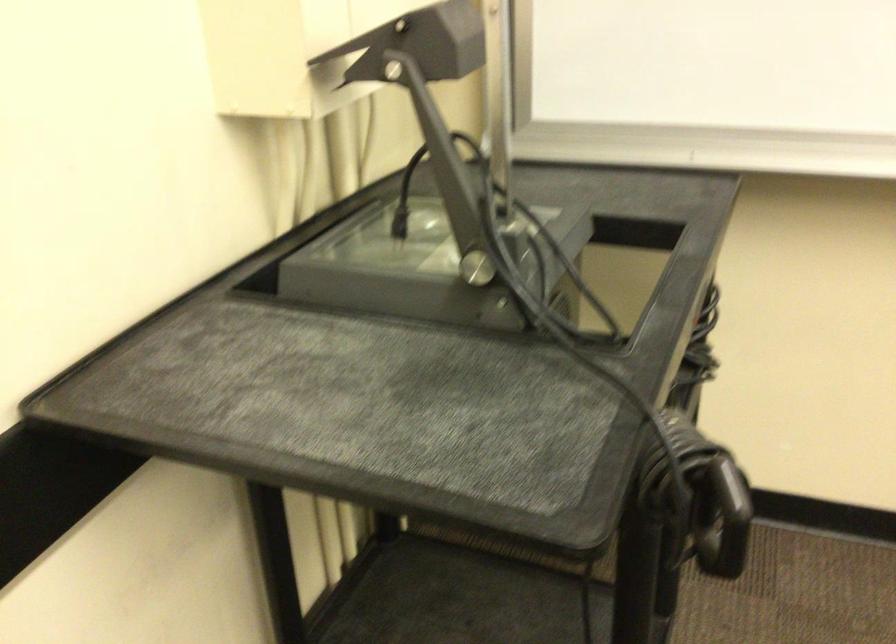
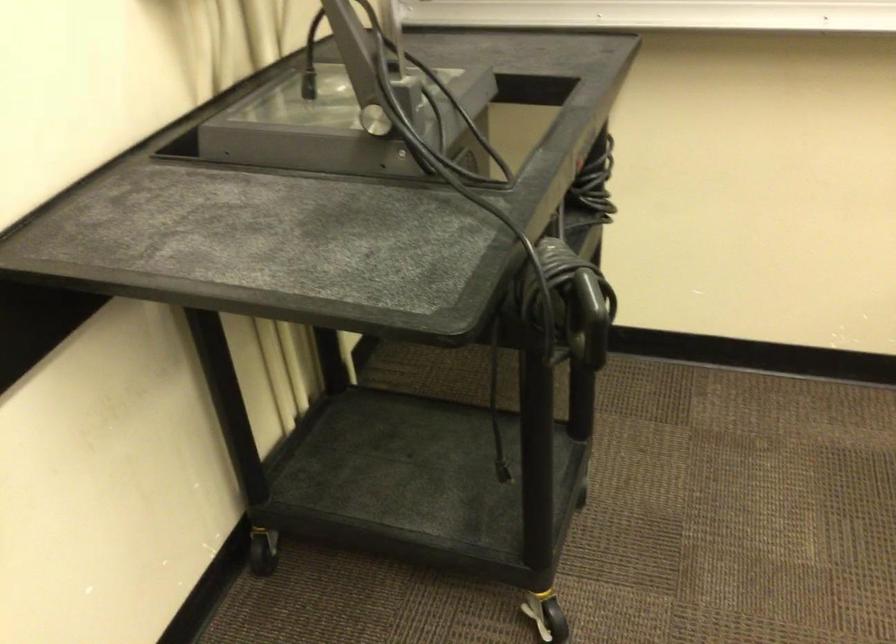
In a continuous first-person perspective shot, in which direction is the camera moving?

The cameraman moved toward right, backward.